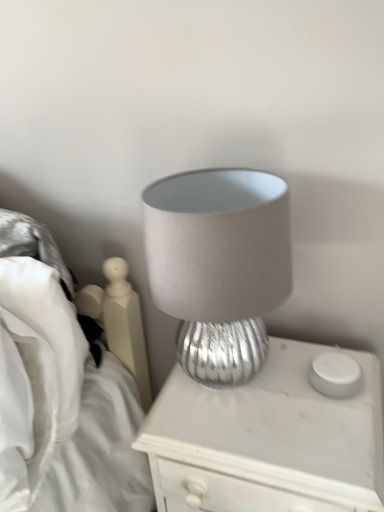
I want to click on silver textured lamp at center, so click(267, 440).

Is silver textured lamp at center inside satin gray lampshade at center?

Definitely not — silver textured lamp at center is not inside satin gray lampshade at center.

Does satin gray lampshade at center appear on the right side of silver textured lamp at center?

In fact, satin gray lampshade at center is to the left of silver textured lamp at center.

In terms of size, does satin gray lampshade at center appear bigger or smaller than silver textured lamp at center?

satin gray lampshade at center is smaller than silver textured lamp at center.

Which point is more forward, (x=164, y=180) or (x=364, y=464)?

The point (x=364, y=464) is closer to the camera.

Is white matte candle holder at right wider or thinner than silver textured lamp at center?

In the image, white matte candle holder at right appears to be more narrow than silver textured lamp at center.

Looking at this image, is silver textured lamp at center located within white matte candle holder at right?

No, silver textured lamp at center is not surrounded by white matte candle holder at right.

How many degrees apart are the facing directions of white matte candle holder at right and silver textured lamp at center?

There is a 2.44-degree angle between the facing directions of white matte candle holder at right and silver textured lamp at center.

From a real-world perspective, which is physically above, silver textured lamp at center or white matte candle holder at right?

From a 3D spatial view, white matte candle holder at right is above.

Is silver textured lamp at center outside of white matte candle holder at right?

Absolutely, silver textured lamp at center is external to white matte candle holder at right.

From the image's perspective, is silver textured lamp at center located above or below white matte candle holder at right?

silver textured lamp at center is below white matte candle holder at right.

Between silver textured lamp at center and white matte candle holder at right, which one has more height?

With more height is silver textured lamp at center.

From the image's perspective, which is above, white matte candle holder at right or satin gray lampshade at center?

satin gray lampshade at center appears higher in the image.

Based on their sizes in the image, would you say white matte candle holder at right is bigger or smaller than satin gray lampshade at center?

In the image, white matte candle holder at right appears to be smaller than satin gray lampshade at center.

Is white matte candle holder at right facing towards satin gray lampshade at center?

No, white matte candle holder at right is not aimed at satin gray lampshade at center.

Based on the photo, does white matte candle holder at right have a greater height compared to satin gray lampshade at center?

In fact, white matte candle holder at right may be shorter than satin gray lampshade at center.

From the image's perspective, which is above, satin gray lampshade at center or white matte candle holder at right?

satin gray lampshade at center.

Which is behind, point (201, 323) or point (350, 366)?

The point (350, 366) is behind.

Would you say satin gray lampshade at center is a long distance from white matte candle holder at right?

Actually, satin gray lampshade at center and white matte candle holder at right are a little close together.

Who is more distant, satin gray lampshade at center or white matte candle holder at right?

white matte candle holder at right is behind.

From a real-world perspective, which is physically below, silver textured lamp at center or satin gray lampshade at center?

From a 3D spatial view, silver textured lamp at center is below.

Based on the photo, how many degrees apart are the facing directions of silver textured lamp at center and satin gray lampshade at center?

silver textured lamp at center and satin gray lampshade at center are facing 0.0199 degrees away from each other.

Could you tell me if silver textured lamp at center is facing satin gray lampshade at center?

No, silver textured lamp at center is not oriented towards satin gray lampshade at center.

Find the location of a particular element. The height and width of the screenshot is (512, 384). lamp located above the silver textured lamp at center (from a real-world perspective) is located at coordinates (219, 266).

Locate an element on the screen. The width and height of the screenshot is (384, 512). candle holder on the right side of silver textured lamp at center is located at coordinates (335, 375).

Based on their spatial positions, is satin gray lampshade at center or white matte candle holder at right closer to silver textured lamp at center?

The object closer to silver textured lamp at center is white matte candle holder at right.

Considering their positions, is satin gray lampshade at center positioned further to white matte candle holder at right than silver textured lamp at center?

satin gray lampshade at center is positioned further to the anchor white matte candle holder at right.

From the image, which object appears to be nearer to white matte candle holder at right, silver textured lamp at center or satin gray lampshade at center?

The object closer to white matte candle holder at right is silver textured lamp at center.

Looking at the image, which one is located further to satin gray lampshade at center, silver textured lamp at center or white matte candle holder at right?

white matte candle holder at right is positioned further to the anchor satin gray lampshade at center.

When comparing their distances from silver textured lamp at center, does white matte candle holder at right or satin gray lampshade at center seem further?

Among the two, satin gray lampshade at center is located further to silver textured lamp at center.

When comparing their distances from satin gray lampshade at center, does white matte candle holder at right or silver textured lamp at center seem further?

Among the two, white matte candle holder at right is located further to satin gray lampshade at center.

You are a GUI agent. You are given a task and a screenshot of the screen. Output one action in this format:
    pyautogui.click(x=<x>, y=<y>)
    Task: Click on the candle holder between satin gray lampshade at center and silver textured lamp at center vertically
    The image size is (384, 512).
    Given the screenshot: What is the action you would take?
    tap(335, 375)